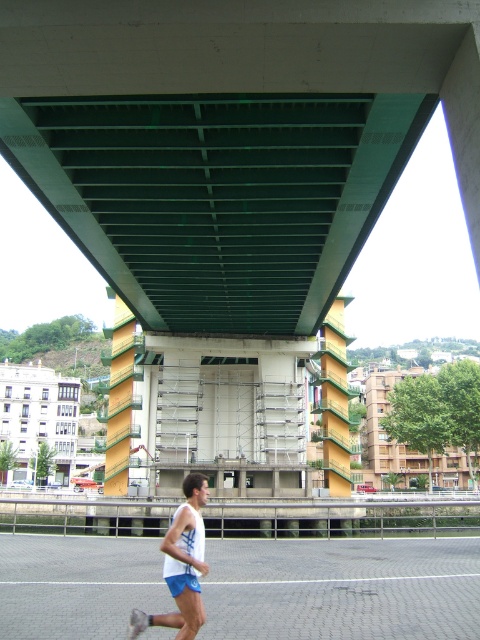
Looking at this image, does green painted steel bridge at upper center appear under white matte tank top at lower center?

No.

Locate an element on the screen. green painted steel bridge at upper center is located at coordinates (231, 141).

Locate an element on the screen. This screenshot has height=640, width=480. green painted steel bridge at upper center is located at coordinates (231, 141).